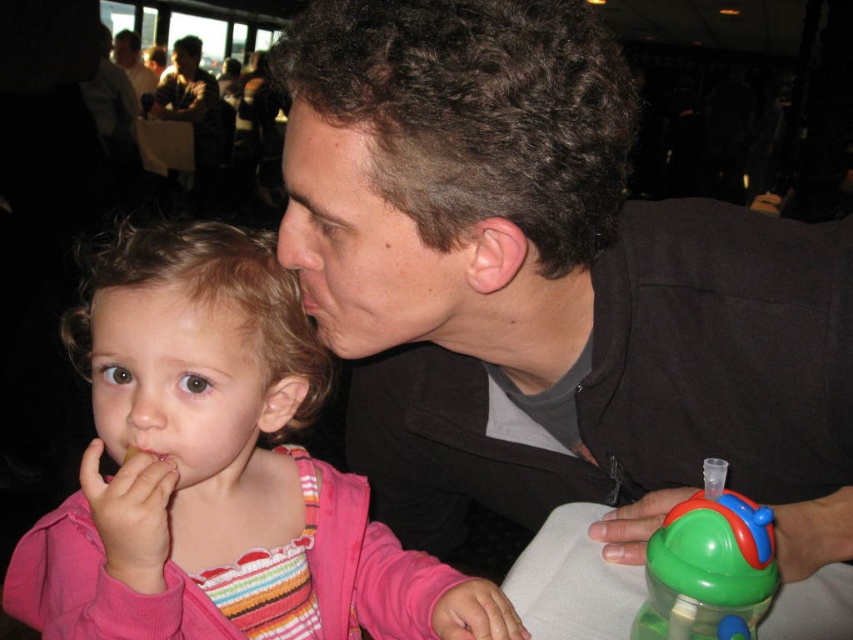
You are at a social event and want to move from the location of point (137, 49) to the location of point (769, 573). Which direction should you move in?

You should move forward because point (769, 573) is in front of point (137, 49).